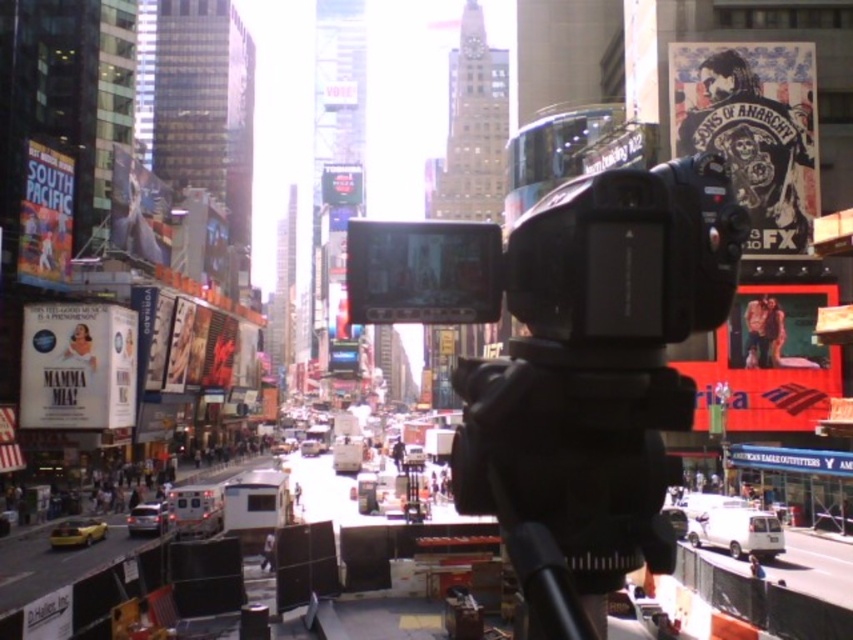
You are a photographer trying to capture a clear shot of the metallic silver van at lower left using the black plastic video camera at center. Given their relative heights, will the camera be able to see the top of the van?

The black plastic video camera at center is much taller than the metallic silver van at lower left, so the camera should be able to see the top of the van.

You are a photographer standing at the edge of the sidewalk. You have a black matte tripod at center and a metallic silver van at lower left in your view. Which object is positioned higher relative to the other?

The black matte tripod at center is located above the metallic silver van at lower left, so it is positioned higher.

You are a film crew member who needs to move the black plastic video camera at center and the black matte tripod at center to another location. The path you need to take is 25 feet long. Will you be able to move both items together without needing to separate them?

The black plastic video camera at center and black matte tripod at center are 25.14 feet apart from each other. Since the path is only 25 feet long, the distance between them exceeds the path length by 0.14 feet. Therefore, you will not be able to move both items together without separating them.